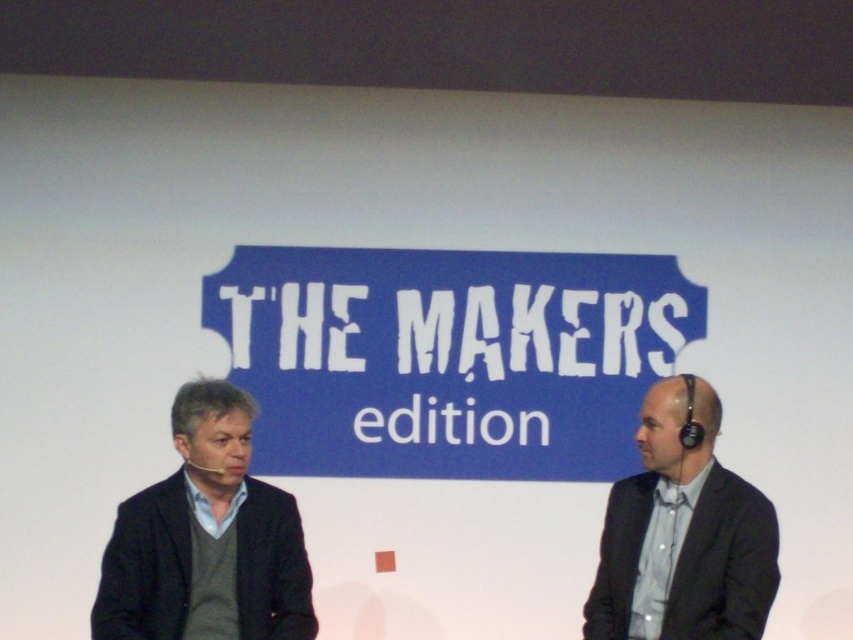
You are a photographer adjusting the lighting for a photo shoot. You need to ensure that both the dark gray sweater at left and the gray fabric suit at right are evenly lit. Based on their positions, which object should you adjust the light to focus on more?

The dark gray sweater at left is positioned under the gray fabric suit at right. Since it is lower in position, you should focus more light on the dark gray sweater at left to ensure even illumination.

You are standing in front of the image and want to know how far the point at coordinates (235, 492) is from you. Can you determine the distance?

The distance between point (235, 492) and the viewer is 3.95 meters.